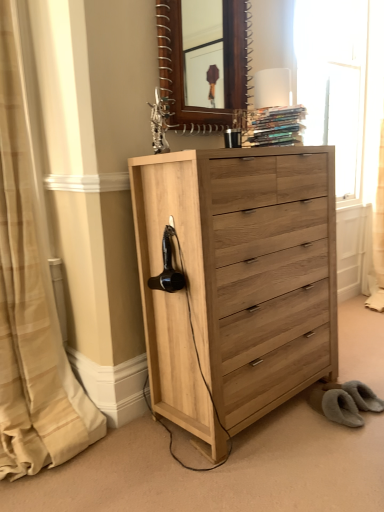
Question: From the image's perspective, is matte white table lamp at upper center on hardcover books at upper center?

Choices:
 (A) no
 (B) yes

Answer: (B)

Question: Can you confirm if matte white table lamp at upper center is wider than hardcover books at upper center?

Choices:
 (A) yes
 (B) no

Answer: (B)

Question: Can you confirm if matte white table lamp at upper center is positioned to the right of hardcover books at upper center?

Choices:
 (A) yes
 (B) no

Answer: (A)

Question: Is matte white table lamp at upper center positioned far away from hardcover books at upper center?

Choices:
 (A) yes
 (B) no

Answer: (B)

Question: Is matte white table lamp at upper center turned away from hardcover books at upper center?

Choices:
 (A) no
 (B) yes

Answer: (A)

Question: Which is correct: matte white table lamp at upper center is inside beige striped curtain at left, or outside of it?

Choices:
 (A) outside
 (B) inside

Answer: (A)

Question: Relative to beige striped curtain at left, is matte white table lamp at upper center in front or behind?

Choices:
 (A) front
 (B) behind

Answer: (B)

Question: Looking at the image, does matte white table lamp at upper center seem bigger or smaller compared to beige striped curtain at left?

Choices:
 (A) small
 (B) big

Answer: (A)

Question: Based on their positions, is matte white table lamp at upper center located to the left or right of beige striped curtain at left?

Choices:
 (A) left
 (B) right

Answer: (B)

Question: From a real-world perspective, is black matte hair dryer at left physically located above or below transparent glass window at upper right?

Choices:
 (A) above
 (B) below

Answer: (B)

Question: Is point (167, 249) closer or farther from the camera than point (357, 17)?

Choices:
 (A) farther
 (B) closer

Answer: (B)

Question: In terms of height, does black matte hair dryer at left look taller or shorter compared to transparent glass window at upper right?

Choices:
 (A) tall
 (B) short

Answer: (B)

Question: In the image, is black matte hair dryer at left on the left side or the right side of transparent glass window at upper right?

Choices:
 (A) right
 (B) left

Answer: (B)

Question: From a real-world perspective, is hardcover books at upper center physically located above or below beige striped curtain at left?

Choices:
 (A) below
 (B) above

Answer: (B)

Question: Is point (251, 129) positioned closer to the camera than point (3, 475)?

Choices:
 (A) closer
 (B) farther

Answer: (B)